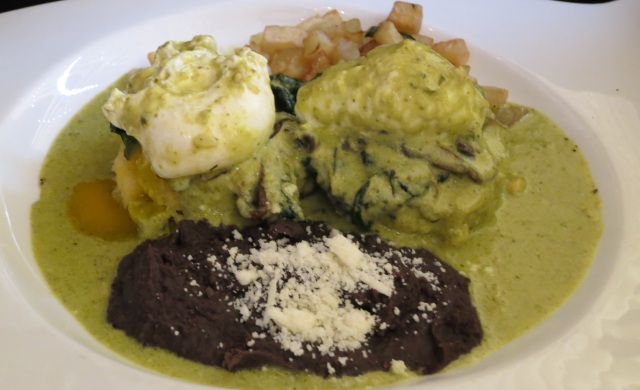
The height and width of the screenshot is (390, 640). What are the coordinates of `plate` in the screenshot? It's located at (60, 51).